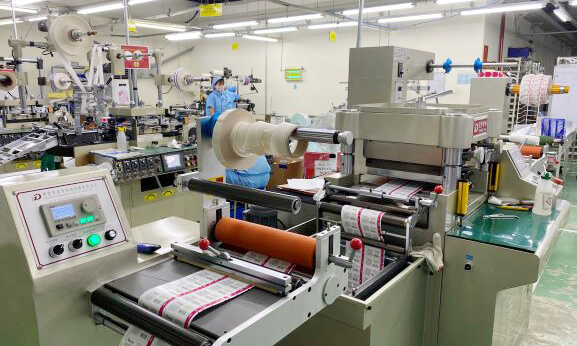
Where is `back wall`? The image size is (577, 346). back wall is located at coordinates pyautogui.click(x=494, y=34), pyautogui.click(x=328, y=74).